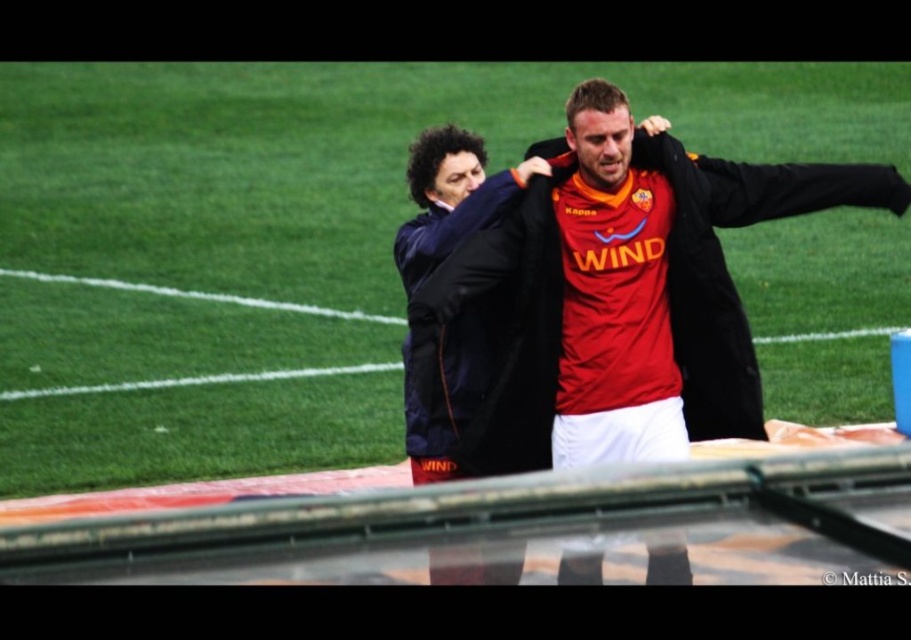
Does green grass football field at center appear over matte black jacket at center?

Yes, green grass football field at center is above matte black jacket at center.

Who is taller, green grass football field at center or matte black jacket at center?

green grass football field at center is taller.

Does point (186, 468) come closer to viewer compared to point (735, 388)?

No.

Locate an element on the screen. The image size is (911, 640). green grass football field at center is located at coordinates (x=288, y=240).